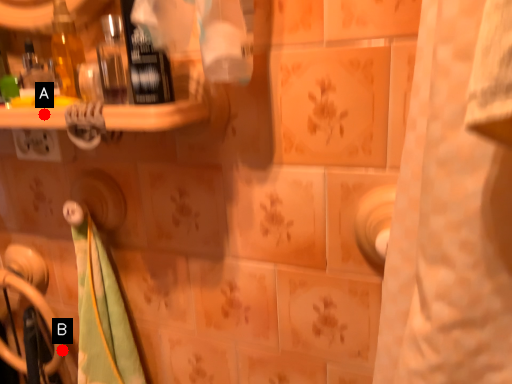
Question: Two points are circled on the image, labeled by A and B beside each circle. Which of the following is the closest to the observer?

Choices:
 (A) A is closer
 (B) B is closer

Answer: (A)